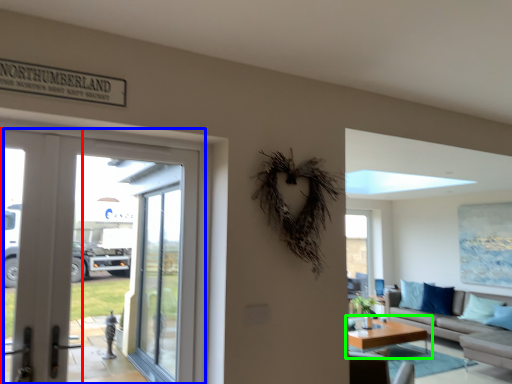
Question: Which is farther away from screen door (highlighted by a red box)? door (highlighted by a blue box) or coffee table (highlighted by a green box)?

Choices:
 (A) door
 (B) coffee table

Answer: (B)